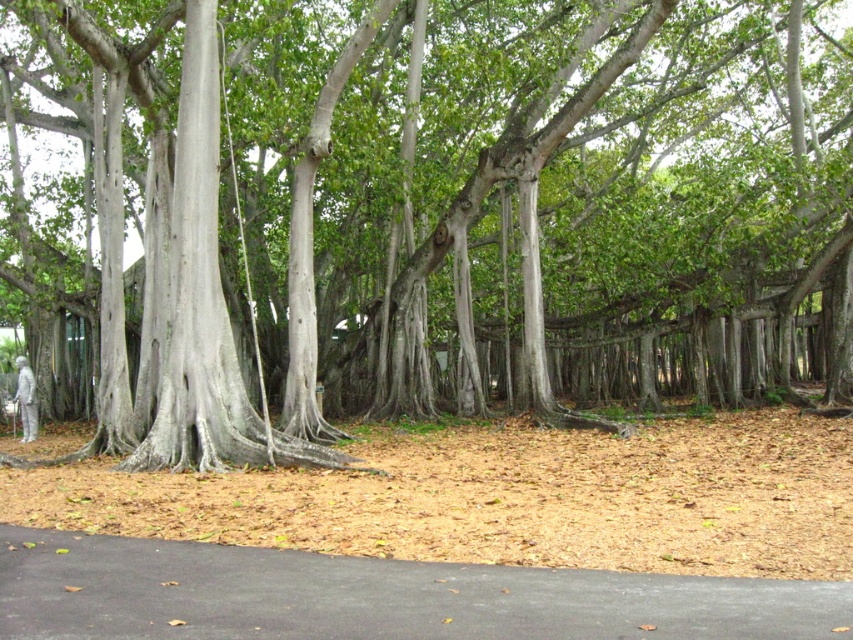
You are a gardener who needs to water the green leafy tree at center using a hose that can reach 15 meters. You are standing on the black asphalt path at lower center. Can you water the tree without moving from your current position?

The green leafy tree at center is 17.62 meters away from the black asphalt path at lower center. Since the hose can only reach 15 meters, you cannot water the tree without moving closer.

You are a hiker who wants to take a photo of the green leafy tree at center from above. Is the black asphalt path at lower center an obstacle for your drone to fly over?

The green leafy tree at center is much taller than the black asphalt path at lower center, so the drone can fly over the black asphalt path at lower center to capture the tree from above.